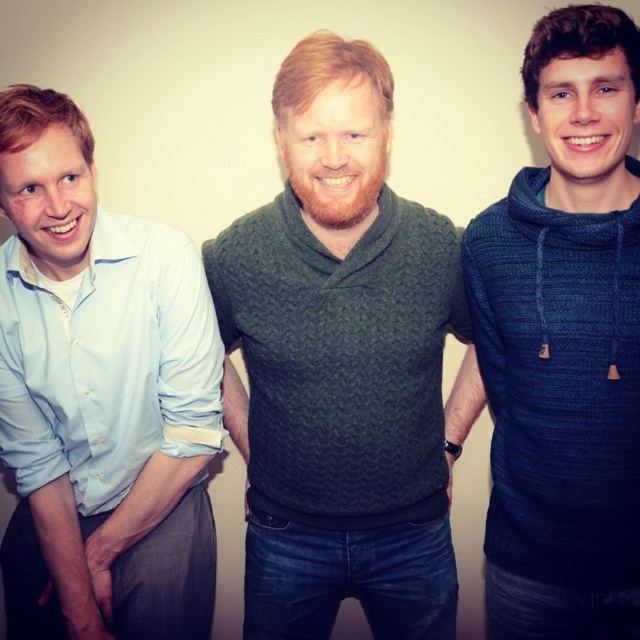
Question: Based on their relative distances, which object is nearer to the light blue shirt at left?

Choices:
 (A) dark green knitted sweater at center
 (B) dark blue knitted hoodie at center

Answer: (A)

Question: Is light blue shirt at left above dark blue knitted hoodie at center?

Choices:
 (A) no
 (B) yes

Answer: (A)

Question: Is dark green knitted sweater at center further to the viewer compared to dark blue knitted hoodie at center?

Choices:
 (A) no
 (B) yes

Answer: (B)

Question: Which object is closer to the camera taking this photo?

Choices:
 (A) dark green knitted sweater at center
 (B) dark blue knitted hoodie at center

Answer: (B)

Question: Which point appears farthest from the camera in this image?

Choices:
 (A) (541, 561)
 (B) (262, 636)
 (C) (29, 492)

Answer: (B)

Question: Does light blue shirt at left appear under dark blue knitted hoodie at center?

Choices:
 (A) yes
 (B) no

Answer: (A)